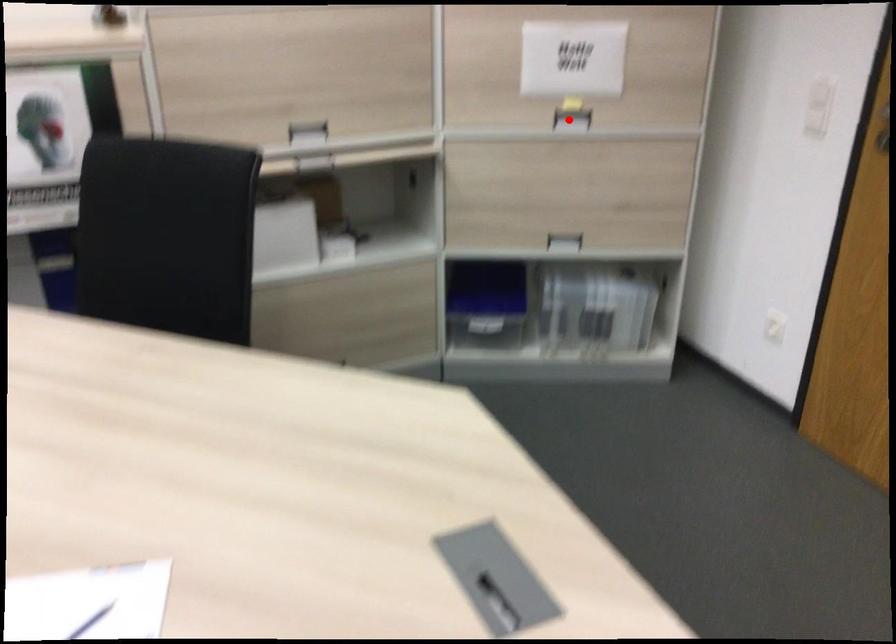
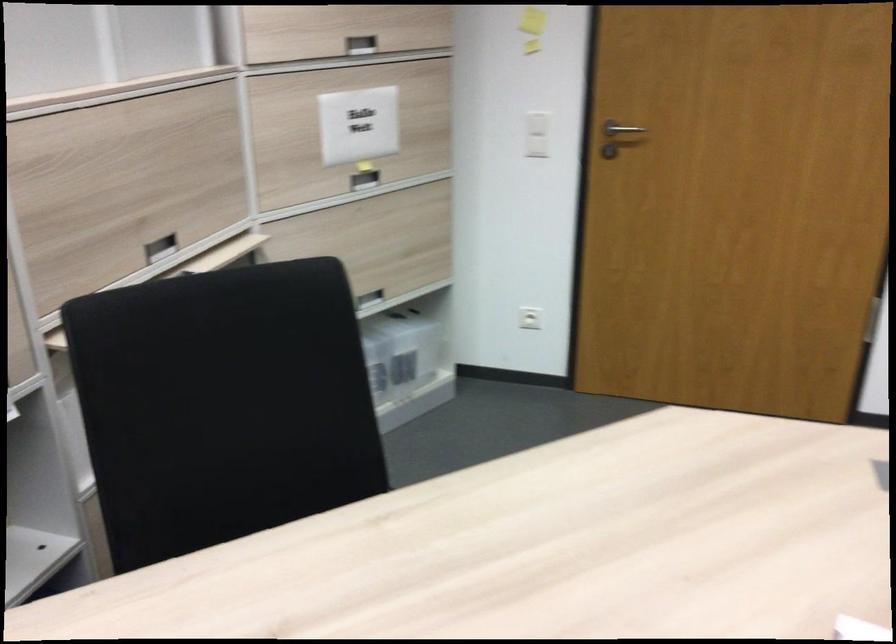
Find the pixel in the second image that matches the highlighted location in the first image.

(364, 180)